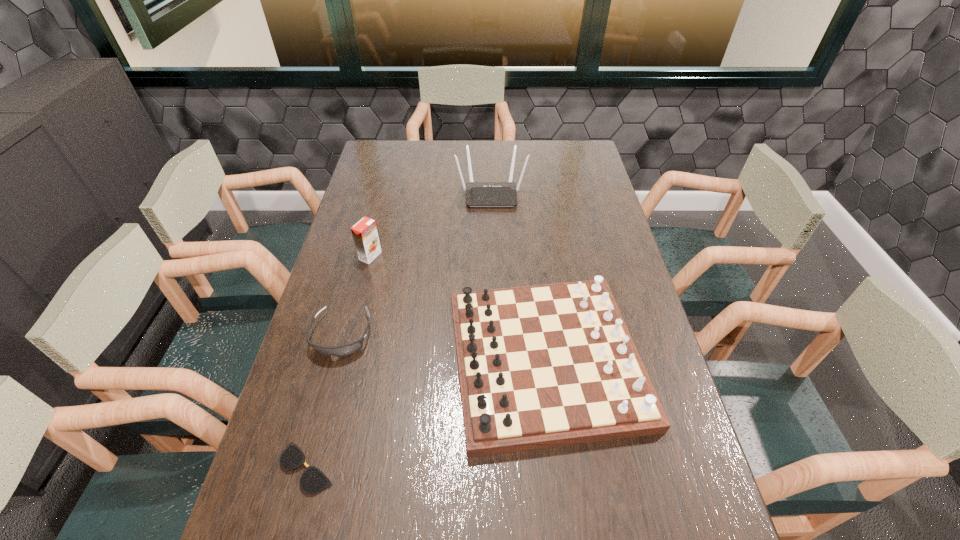
Where is `the farthest object`? The width and height of the screenshot is (960, 540). the farthest object is located at coordinates click(x=478, y=194).

Identify the location of the tallest object. (478, 194).

This screenshot has height=540, width=960. Identify the location of the fourth shortest object. (364, 232).

The width and height of the screenshot is (960, 540). I want to click on orange juice, so click(x=364, y=232).

Identify the location of the third shortest object. pyautogui.click(x=540, y=366).

This screenshot has width=960, height=540. In order to click on goggles in this screenshot , I will do `click(345, 350)`.

The width and height of the screenshot is (960, 540). Find the location of `the shortest object`. the shortest object is located at coordinates (312, 481).

Locate an element on the screen. The height and width of the screenshot is (540, 960). vacant space located on the front-facing side of the farthest object is located at coordinates (492, 228).

Where is `blank area located on the back of the fourth nearest object`? blank area located on the back of the fourth nearest object is located at coordinates (375, 236).

Where is `vacant point located 0.300m on the back of the chessboard`? vacant point located 0.300m on the back of the chessboard is located at coordinates click(x=529, y=224).